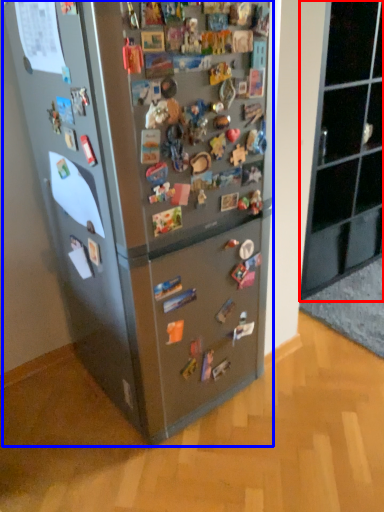
Question: Which point is further to the camera, cabinetry (highlighted by a red box) or refrigerator (highlighted by a blue box)?

Choices:
 (A) cabinetry
 (B) refrigerator

Answer: (A)